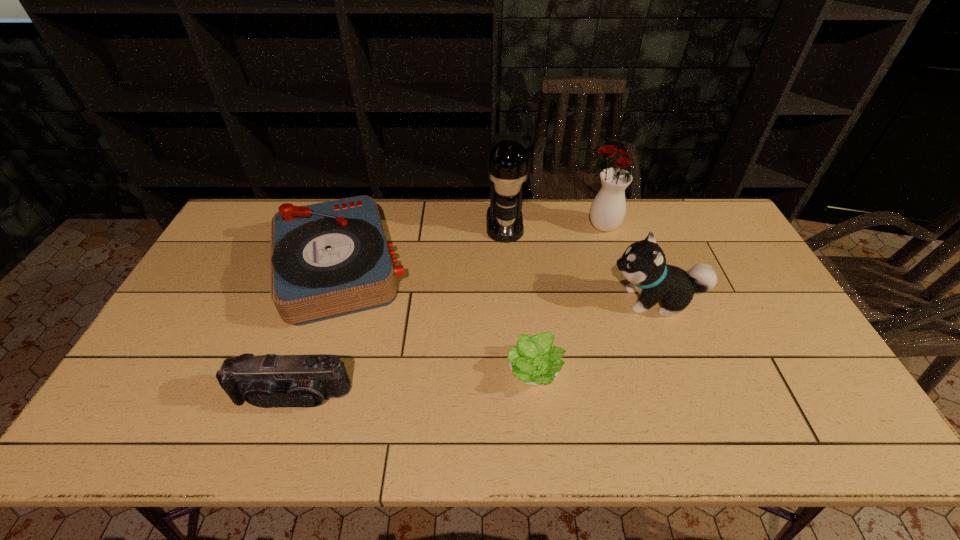
The height and width of the screenshot is (540, 960). I want to click on free space at the right edge of the desktop, so click(746, 268).

This screenshot has height=540, width=960. I want to click on vacant point at the near right corner, so click(859, 442).

The width and height of the screenshot is (960, 540). Find the location of `unoccupied area between the coffee maker and the camcorder`. unoccupied area between the coffee maker and the camcorder is located at coordinates (398, 309).

At what (x,y) coordinates should I click in order to perform the action: click on free area in between the coffee maker and the record player. Please return your answer as a coordinate pair (x, y). This screenshot has height=540, width=960. Looking at the image, I should click on (422, 246).

Where is `vacant area that lies between the coffee maker and the lettuce`? The width and height of the screenshot is (960, 540). vacant area that lies between the coffee maker and the lettuce is located at coordinates (519, 298).

Where is `vacant point located between the fourth shortest object and the record player`? This screenshot has width=960, height=540. vacant point located between the fourth shortest object and the record player is located at coordinates (497, 284).

The width and height of the screenshot is (960, 540). In order to click on free space between the shortest object and the record player in this screenshot , I will do `click(438, 320)`.

Locate an element on the screen. The image size is (960, 540). unoccupied area between the vase and the camcorder is located at coordinates (446, 311).

The height and width of the screenshot is (540, 960). Identify the location of free spot between the shortest object and the fourth shortest object. (595, 336).

Find the location of a particular element. vacant space that is in between the camcorder and the coffee maker is located at coordinates (398, 309).